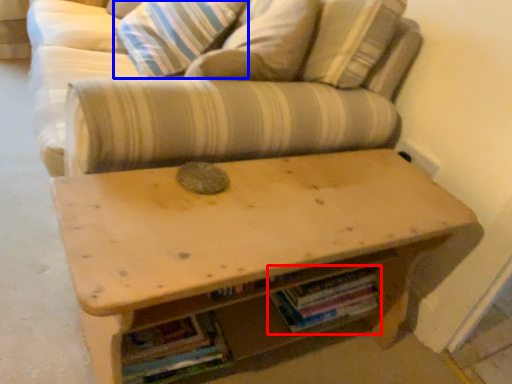
Question: Among these objects, which one is nearest to the camera, book (highlighted by a red box) or pillow (highlighted by a blue box)?

Choices:
 (A) book
 (B) pillow

Answer: (A)